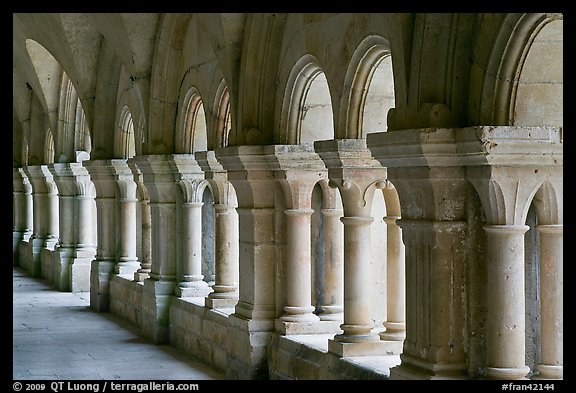
The width and height of the screenshot is (576, 393). I want to click on floor, so click(x=90, y=350).